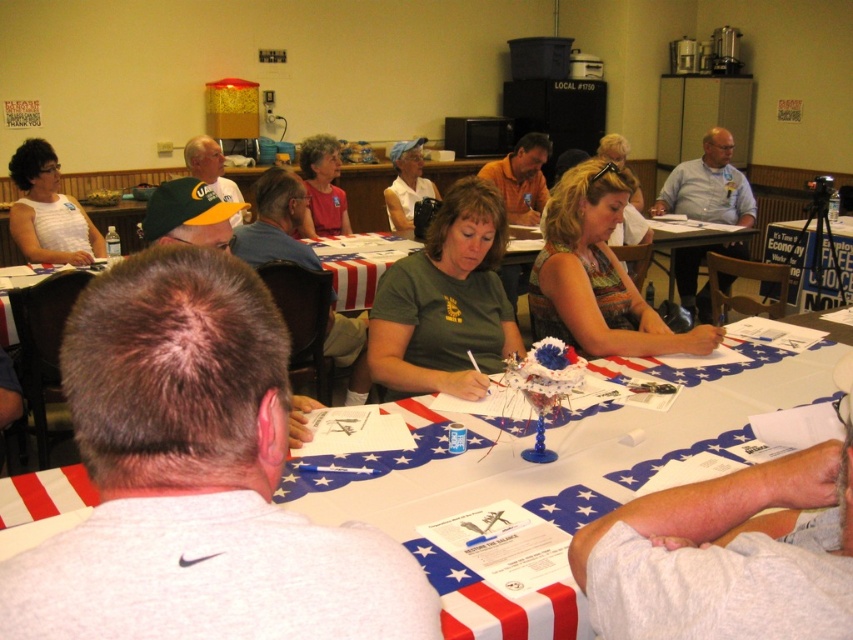
Question: Which point is farther to the camera?

Choices:
 (A) white cotton shirt at center
 (B) green fabric shirt at center
 (C) matte black camera at center

Answer: (C)

Question: Is white paper with patriotic design at center further to camera compared to yellow-green jersey at upper left?

Choices:
 (A) no
 (B) yes

Answer: (A)

Question: Is multicolored fabric dress at center wider than matte black camera at center?

Choices:
 (A) yes
 (B) no

Answer: (A)

Question: In this image, where is green matte shirt at center located relative to yellow-green jersey at upper left?

Choices:
 (A) above
 (B) below

Answer: (B)

Question: Which object is closer to the camera taking this photo?

Choices:
 (A) matte black camera at center
 (B) green fabric cap at upper left
 (C) green matte shirt at center
 (D) green fabric shirt at center

Answer: (B)

Question: Among these objects, which one is nearest to the camera?

Choices:
 (A) matte red shirt at center
 (B) multicolored fabric dress at center
 (C) yellow-green jersey at upper left

Answer: (B)